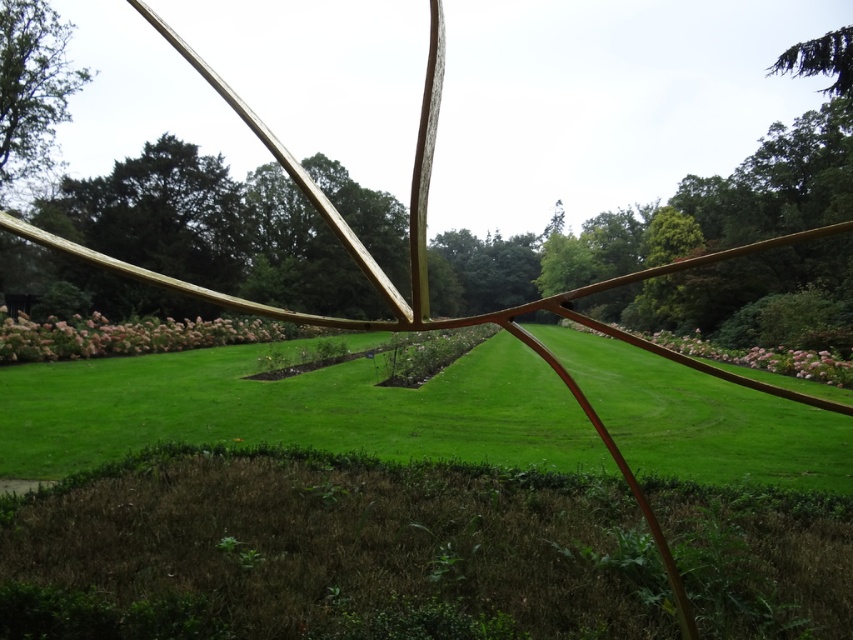
Can you confirm if wooden sculpture at center is shorter than pink fluffy flowers at center?

Incorrect, wooden sculpture at center's height does not fall short of pink fluffy flowers at center's.

Which of these two, wooden sculpture at center or pink fluffy flowers at center, stands taller?

wooden sculpture at center is taller.

Image resolution: width=853 pixels, height=640 pixels. In order to click on wooden sculpture at center in this screenshot , I will do `click(308, 198)`.

Does green grass at center appear on the right side of wooden sculpture at center?

Indeed, green grass at center is positioned on the right side of wooden sculpture at center.

Which is in front, point (717, 468) or point (177, 45)?

Point (177, 45)

I want to click on green grass at center, so click(x=292, y=410).

In the scene shown: Does wooden sculpture at center appear over pink fluffy grass at center?

Yes.

The height and width of the screenshot is (640, 853). What are the coordinates of `wooden sculpture at center` in the screenshot? It's located at (308, 198).